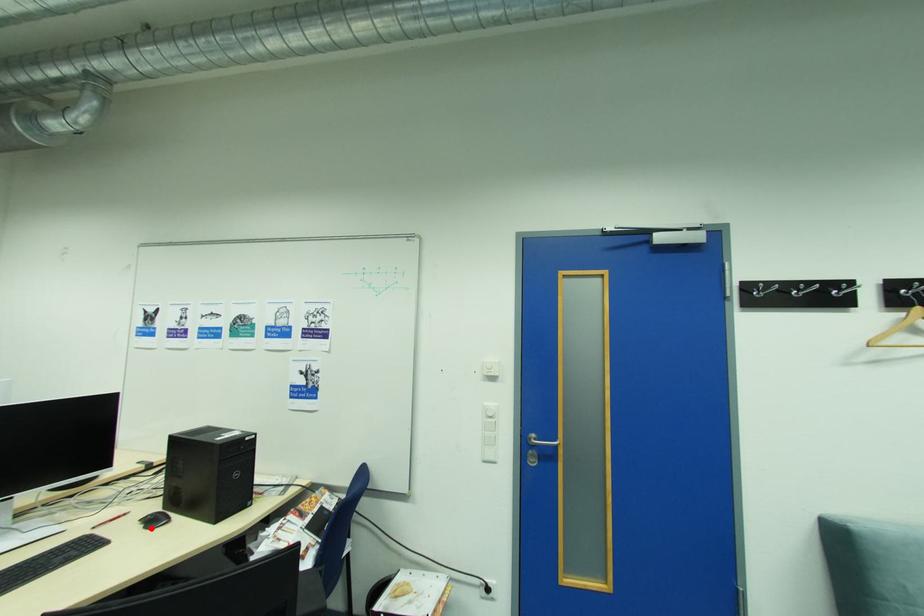
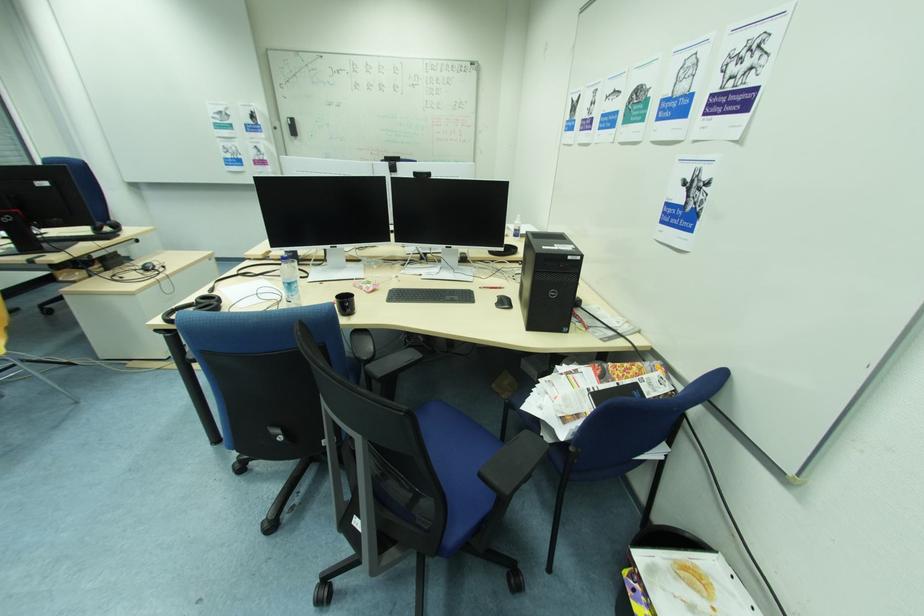
The point at the highlighted location is marked in the first image. Where is the corresponding point in the second image?

(503, 305)